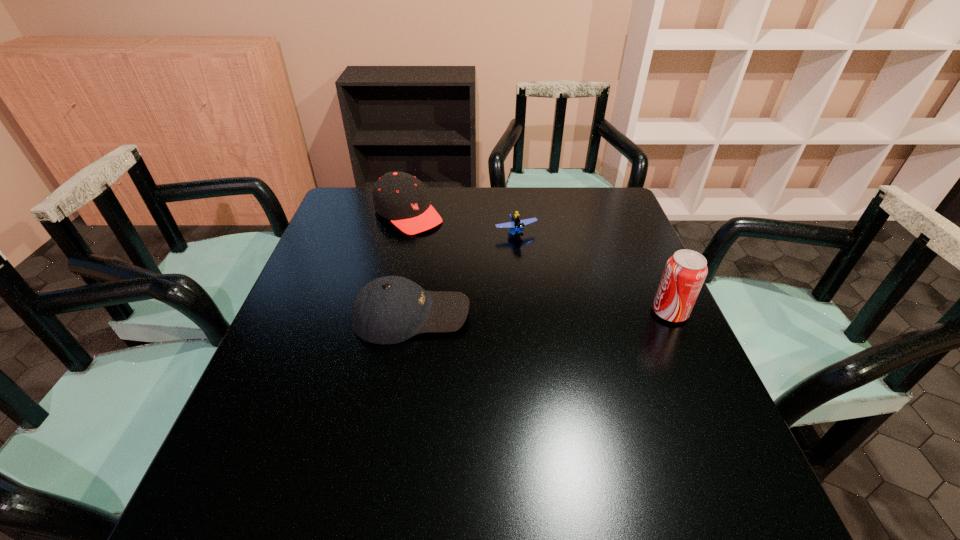
The width and height of the screenshot is (960, 540). What are the coordinates of `baseball cap` in the screenshot? It's located at (389, 310).

You are a GUI agent. You are given a task and a screenshot of the screen. Output one action in this format:
    pyautogui.click(x=<x>, y=<y>)
    Task: Click on the tallest object
    The width and height of the screenshot is (960, 540).
    Given the screenshot: What is the action you would take?
    pyautogui.click(x=685, y=272)

The image size is (960, 540). I want to click on the rightmost object, so click(x=685, y=272).

You are a GUI agent. You are given a task and a screenshot of the screen. Output one action in this format:
    pyautogui.click(x=<x>, y=<y>)
    Task: Click on the cap
    
    Given the screenshot: What is the action you would take?
    pyautogui.click(x=400, y=197)

Image resolution: width=960 pixels, height=540 pixels. In order to click on Lego in this screenshot , I will do `click(516, 225)`.

The image size is (960, 540). In order to click on the third object from left to right in this screenshot , I will do `click(516, 225)`.

Where is `vacant area located 0.250m on the front-facing side of the second shortest object`? vacant area located 0.250m on the front-facing side of the second shortest object is located at coordinates (574, 315).

Identify the location of vacant area situated on the logo side of the soda can. (523, 312).

The image size is (960, 540). Find the location of `vacant position located on the logo side of the soda can`. vacant position located on the logo side of the soda can is located at coordinates (582, 312).

The height and width of the screenshot is (540, 960). Identify the location of free region located on the logo side of the soda can. (619, 312).